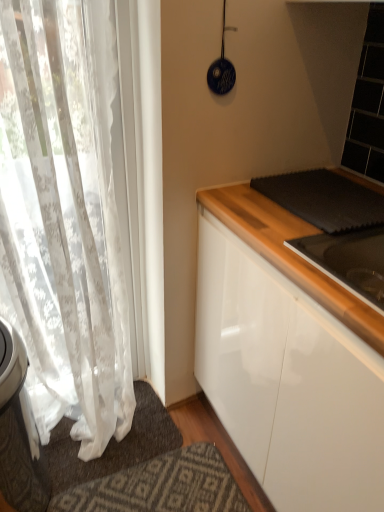
Question: Is point (117, 382) positioned closer to the camera than point (97, 458)?

Choices:
 (A) farther
 (B) closer

Answer: (B)

Question: From their relative heights in the image, would you say white lace curtain at left is taller or shorter than white fabric doormat at lower left?

Choices:
 (A) tall
 (B) short

Answer: (A)

Question: Is white lace curtain at left bigger or smaller than white fabric doormat at lower left?

Choices:
 (A) big
 (B) small

Answer: (A)

Question: Is white fabric doormat at lower left inside the boundaries of white lace curtain at left, or outside?

Choices:
 (A) outside
 (B) inside

Answer: (A)

Question: Looking at their shapes, would you say white fabric doormat at lower left is wider or thinner than white lace curtain at left?

Choices:
 (A) thin
 (B) wide

Answer: (B)

Question: Is white fabric doormat at lower left taller or shorter than white lace curtain at left?

Choices:
 (A) short
 (B) tall

Answer: (A)

Question: Is white fabric doormat at lower left bigger or smaller than white lace curtain at left?

Choices:
 (A) small
 (B) big

Answer: (A)